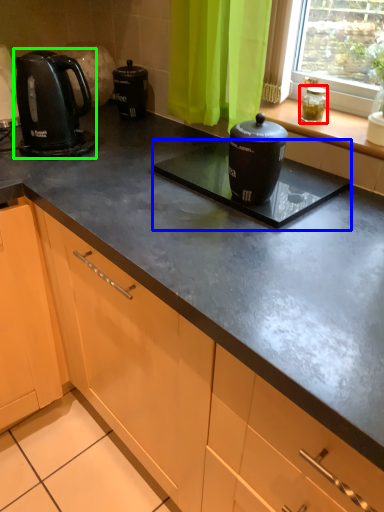
Question: Considering the real-world distances, which object is closest to appliance (highlighted by a red box)? appliance (highlighted by a blue box) or kitchen appliance (highlighted by a green box).

Choices:
 (A) appliance
 (B) kitchen appliance

Answer: (A)